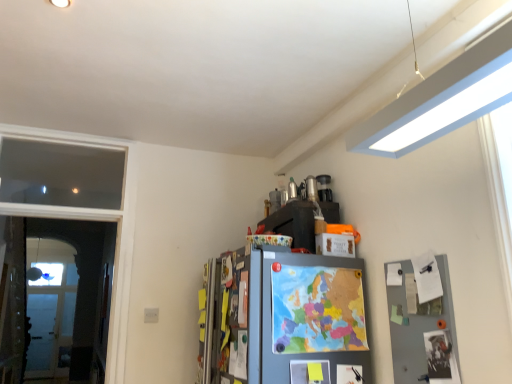
Question: Is clear glass screen door at left wider or thinner than transparent glass window at left?

Choices:
 (A) thin
 (B) wide

Answer: (A)

Question: Visually, is clear glass screen door at left positioned to the left or to the right of transparent glass window at left?

Choices:
 (A) right
 (B) left

Answer: (A)

Question: Is clear glass screen door at left in front of or behind transparent glass window at left in the image?

Choices:
 (A) behind
 (B) front

Answer: (B)

Question: Is point (74, 190) closer or farther from the camera than point (18, 345)?

Choices:
 (A) farther
 (B) closer

Answer: (B)

Question: Which is correct: transparent glass window at left is inside clear glass screen door at left, or outside of it?

Choices:
 (A) inside
 (B) outside

Answer: (B)

Question: In terms of width, does transparent glass window at left look wider or thinner when compared to clear glass screen door at left?

Choices:
 (A) thin
 (B) wide

Answer: (B)

Question: From the image's perspective, is transparent glass window at left positioned above or below clear glass screen door at left?

Choices:
 (A) below
 (B) above

Answer: (B)